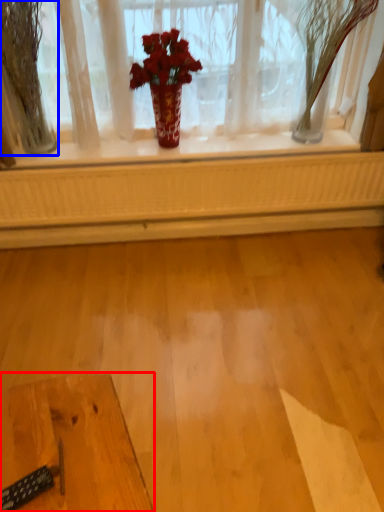
Question: Among these objects, which one is nearest to the camera, table (highlighted by a red box) or tree (highlighted by a blue box)?

Choices:
 (A) table
 (B) tree

Answer: (A)